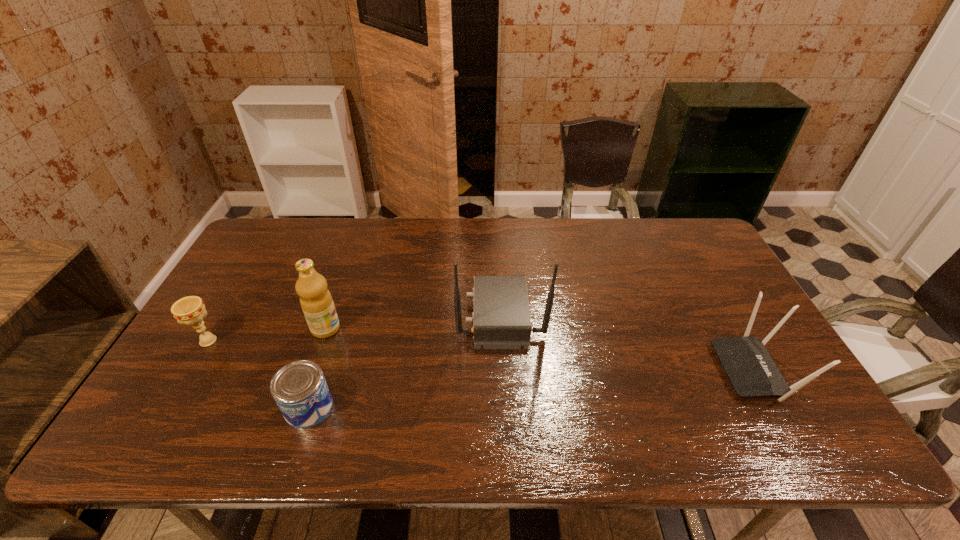
Locate an element on the screen. The width and height of the screenshot is (960, 540). free space between the fourth shortest object and the fourth object from left to right is located at coordinates (413, 322).

This screenshot has height=540, width=960. Find the location of `empty space that is in between the leftmost object and the shortest object`. empty space that is in between the leftmost object and the shortest object is located at coordinates (258, 374).

The image size is (960, 540). I want to click on vacant area between the olive oil and the rightmost object, so click(540, 349).

At what (x,y) coordinates should I click in order to perform the action: click on free space between the second tallest object and the tallest object. Please return your answer as a coordinate pair (x, y). Looking at the image, I should click on (413, 322).

Identify the location of vacant area between the shortest object and the right router. This screenshot has width=960, height=540. (532, 389).

Where is `object that is the second closest one to the can`? The height and width of the screenshot is (540, 960). object that is the second closest one to the can is located at coordinates (190, 310).

Find the location of a particular element. the closest object to the olive oil is located at coordinates (299, 388).